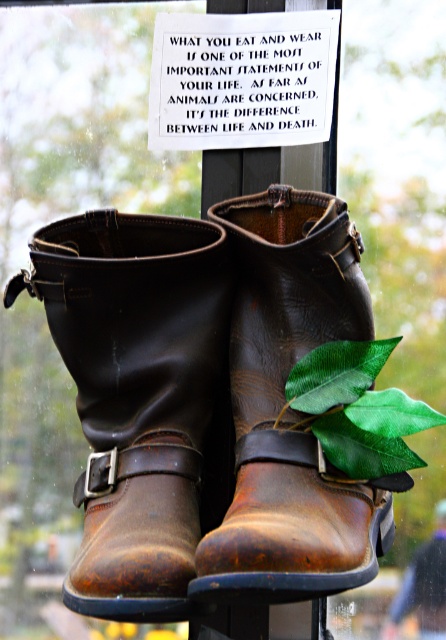
Question: Which of the following is the closest to the observer?

Choices:
 (A) brown leather cowboy boot at center
 (B) brown leather boot at center

Answer: (B)

Question: Which point is closer to the camera?

Choices:
 (A) (240, 545)
 (B) (194, 541)

Answer: (A)

Question: Does brown leather cowboy boot at center appear under brown leather boot at center?

Choices:
 (A) no
 (B) yes

Answer: (B)

Question: Which of the following is the closest to the observer?

Choices:
 (A) tap(380, 529)
 (B) tap(87, 490)

Answer: (B)

Question: In this image, where is brown leather cowboy boot at center located relative to brown leather boot at center?

Choices:
 (A) left
 (B) right

Answer: (A)

Question: Can you confirm if brown leather cowboy boot at center is positioned below brown leather boot at center?

Choices:
 (A) no
 (B) yes

Answer: (B)